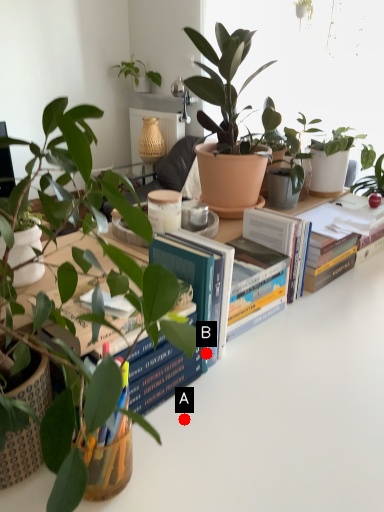
Question: Two points are circled on the image, labeled by A and B beside each circle. Which point is farther from the camera taking this photo?

Choices:
 (A) A is further
 (B) B is further

Answer: (B)